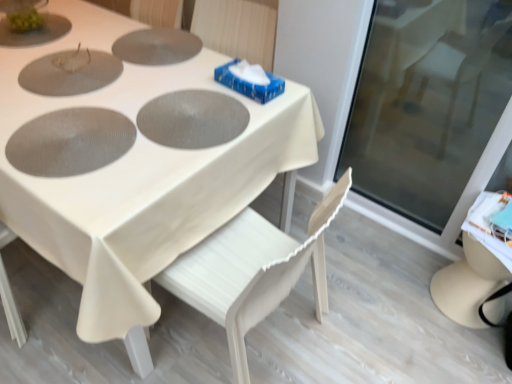
You are a GUI agent. You are given a task and a screenshot of the screen. Output one action in this format:
    pyautogui.click(x=<x>, y=<y>)
    Task: Click on the matte gray pizza pan at upper center, the 1th pizza pan when ordered from back to front
    The image size is (512, 384).
    Given the screenshot: What is the action you would take?
    pyautogui.click(x=157, y=46)

Describe the element at coordinates (157, 46) in the screenshot. I see `matte gray pizza pan at upper center, the 1th pizza pan when ordered from back to front` at that location.

This screenshot has width=512, height=384. Find the location of `matte gray pizza pan at center, which appears as the third pizza pan when viewed from the back`. matte gray pizza pan at center, which appears as the third pizza pan when viewed from the back is located at coordinates (70, 142).

At what (x,y) coordinates should I click in order to perform the action: click on matte gray pizza pan at upper center, which is the 3th pizza pan from front to back. Please return your answer as a coordinate pair (x, y). Looking at the image, I should click on (157, 46).

From a real-world perspective, which is physically above, matte gray pizza pan at upper center, which is the 3th pizza pan from front to back, or gray matte pizza pan at center, which is the second pizza pan in back-to-front order?

In real-world perspective, gray matte pizza pan at center, which is the second pizza pan in back-to-front order, is above.

Can you confirm if matte gray pizza pan at upper center, which is the 3th pizza pan from front to back, is positioned to the right of gray matte pizza pan at center, which is the second pizza pan in back-to-front order?

Incorrect, matte gray pizza pan at upper center, which is the 3th pizza pan from front to back, is not on the right side of gray matte pizza pan at center, which is the second pizza pan in back-to-front order.

Which is closer to the camera, (138,47) or (187,134)?

Point (138,47) is farther from the camera than point (187,134).

Which of these two, matte gray pizza pan at upper center, which is the 3th pizza pan from front to back, or gray matte pizza pan at center, which is the second pizza pan from front to back, stands shorter?

Standing shorter between the two is gray matte pizza pan at center, which is the second pizza pan from front to back.

Considering the relative sizes of white wood chair at center and gray matte pizza pan at center, which is the second pizza pan in back-to-front order, in the image provided, is white wood chair at center smaller than gray matte pizza pan at center, which is the second pizza pan in back-to-front order,?

No.

Considering the positions of objects white wood chair at center and gray matte pizza pan at center, which is the second pizza pan from front to back, in the image provided, who is behind, white wood chair at center or gray matte pizza pan at center, which is the second pizza pan from front to back,?

gray matte pizza pan at center, which is the second pizza pan from front to back, is more distant.

Is white wood chair at center far from gray matte pizza pan at center, which is the second pizza pan from front to back?

No, white wood chair at center is not far away from gray matte pizza pan at center, which is the second pizza pan from front to back.

Does white matte table at center come behind transparent glass door at right?

No, white matte table at center is closer to the viewer.

How distant is white matte table at center from transparent glass door at right?

31.61 inches.

Which object is positioned more to the left, white matte table at center or transparent glass door at right?

white matte table at center is more to the left.

What are the coordinates of `glass door on the right side of matte gray pizza pan at upper center, the 1th pizza pan when ordered from back to front` in the screenshot? It's located at (426, 102).

Based on their positions, is matte gray pizza pan at upper center, which is the 3th pizza pan from front to back, located to the left or right of transparent glass door at right?

In the image, matte gray pizza pan at upper center, which is the 3th pizza pan from front to back, appears on the left side of transparent glass door at right.

Is matte gray pizza pan at upper center, the 1th pizza pan when ordered from back to front, situated inside transparent glass door at right or outside?

matte gray pizza pan at upper center, the 1th pizza pan when ordered from back to front, is located beyond the bounds of transparent glass door at right.

Is matte gray pizza pan at upper center, the 1th pizza pan when ordered from back to front, looking in the opposite direction of transparent glass door at right?

matte gray pizza pan at upper center, the 1th pizza pan when ordered from back to front, does not have its back to transparent glass door at right.

Is point (151, 38) less distant than point (86, 37)?

Yes, it is.

From a real-world perspective, does matte gray pizza pan at upper center, which is the 3th pizza pan from front to back, stand above white matte table at center?

Indeed, from a real-world perspective, matte gray pizza pan at upper center, which is the 3th pizza pan from front to back, stands above white matte table at center.

Would you say matte gray pizza pan at upper center, which is the 3th pizza pan from front to back, is inside or outside white matte table at center?

matte gray pizza pan at upper center, which is the 3th pizza pan from front to back, can be found inside white matte table at center.

From the image's perspective, is matte gray pizza pan at upper center, which is the 3th pizza pan from front to back, above or below white matte table at center?

matte gray pizza pan at upper center, which is the 3th pizza pan from front to back, is above white matte table at center.

From a real-world perspective, is matte gray pizza pan at center, which appears as the third pizza pan when viewed from the back, above or below gray matte pizza pan at center, which is the second pizza pan in back-to-front order?

matte gray pizza pan at center, which appears as the third pizza pan when viewed from the back, is situated higher than gray matte pizza pan at center, which is the second pizza pan in back-to-front order, in the real world.

Is matte gray pizza pan at center, which appears as the third pizza pan when viewed from the back, aimed at gray matte pizza pan at center, which is the second pizza pan in back-to-front order?

No.

Relative to gray matte pizza pan at center, which is the second pizza pan from front to back, is matte gray pizza pan at center, which is counted as the 1th pizza pan, starting from the front, in front or behind?

In the image, matte gray pizza pan at center, which is counted as the 1th pizza pan, starting from the front, appears in front of gray matte pizza pan at center, which is the second pizza pan from front to back.

Which is nearer, (85, 131) or (178, 102)?

The point (85, 131) is closer to the camera.

Considering their positions, is white wood chair at center located in front of or behind matte gray pizza pan at center, which is counted as the 1th pizza pan, starting from the front?

white wood chair at center is positioned closer to the viewer than matte gray pizza pan at center, which is counted as the 1th pizza pan, starting from the front.

Is white wood chair at center aimed at matte gray pizza pan at center, which appears as the third pizza pan when viewed from the back?

Yes, white wood chair at center is oriented towards matte gray pizza pan at center, which appears as the third pizza pan when viewed from the back.

Visually, is white wood chair at center positioned to the left or to the right of matte gray pizza pan at center, which is counted as the 1th pizza pan, starting from the front?

Clearly, white wood chair at center is on the right of matte gray pizza pan at center, which is counted as the 1th pizza pan, starting from the front, in the image.

Does point (260, 304) appear closer or farther from the camera than point (39, 174)?

Point (260, 304) is farther from the camera than point (39, 174).

Find the location of a particular element. The image size is (512, 384). pizza pan below the gray matte pizza pan at center, which is the second pizza pan in back-to-front order (from a real-world perspective) is located at coordinates (157, 46).

From a real-world perspective, starting from the white wood chair at center, which pizza pan is the 2nd one vertically above it? Please provide its 2D coordinates.

[(192, 119)]

Considering their positions, is matte gray pizza pan at center, which is counted as the 1th pizza pan, starting from the front, positioned closer to matte gray pizza pan at upper center, which is the 3th pizza pan from front to back, than white matte table at center?

white matte table at center is positioned closer to the anchor matte gray pizza pan at upper center, which is the 3th pizza pan from front to back.

Considering their positions, is gray matte pizza pan at center, which is the second pizza pan in back-to-front order, positioned closer to white matte table at center than matte gray pizza pan at center, which appears as the third pizza pan when viewed from the back?

matte gray pizza pan at center, which appears as the third pizza pan when viewed from the back, lies closer to white matte table at center than the other object.

When comparing their distances from matte gray pizza pan at center, which is counted as the 1th pizza pan, starting from the front, does matte gray pizza pan at upper center, the 1th pizza pan when ordered from back to front, or white matte table at center seem closer?

Among the two, white matte table at center is located nearer to matte gray pizza pan at center, which is counted as the 1th pizza pan, starting from the front.

Based on their spatial positions, is white matte table at center or transparent glass door at right closer to gray matte pizza pan at center, which is the second pizza pan from front to back?

The object closer to gray matte pizza pan at center, which is the second pizza pan from front to back, is white matte table at center.

Looking at the image, which one is located closer to gray matte pizza pan at center, which is the second pizza pan from front to back, transparent glass door at right or white wood chair at center?

Among the two, white wood chair at center is located nearer to gray matte pizza pan at center, which is the second pizza pan from front to back.

Based on their spatial positions, is gray matte pizza pan at center, which is the second pizza pan in back-to-front order, or matte gray pizza pan at center, which appears as the third pizza pan when viewed from the back, closer to white wood chair at center?

gray matte pizza pan at center, which is the second pizza pan in back-to-front order, is closer to white wood chair at center.

Looking at the image, which one is located closer to gray matte pizza pan at center, which is the second pizza pan from front to back, matte gray pizza pan at upper center, the 1th pizza pan when ordered from back to front, or white wood chair at center?

The object closer to gray matte pizza pan at center, which is the second pizza pan from front to back, is matte gray pizza pan at upper center, the 1th pizza pan when ordered from back to front.

From the image, which object appears to be farther from transparent glass door at right, white matte table at center or white wood chair at center?

Among the two, white wood chair at center is located further to transparent glass door at right.

You are a GUI agent. You are given a task and a screenshot of the screen. Output one action in this format:
    pyautogui.click(x=<x>, y=<y>)
    Task: Click on the chair located between matte gray pizza pan at center, which is counted as the 1th pizza pan, starting from the front, and transparent glass door at right in the left-right direction
    This screenshot has width=512, height=384.
    Given the screenshot: What is the action you would take?
    pyautogui.click(x=252, y=271)

The image size is (512, 384). I want to click on chair between matte gray pizza pan at upper center, the 1th pizza pan when ordered from back to front, and transparent glass door at right from left to right, so click(x=252, y=271).

Find the location of a particular element. pizza pan between matte gray pizza pan at center, which is counted as the 1th pizza pan, starting from the front, and matte gray pizza pan at upper center, the 1th pizza pan when ordered from back to front, in the front-back direction is located at coordinates (192, 119).

This screenshot has height=384, width=512. I want to click on chair located between gray matte pizza pan at center, which is the second pizza pan from front to back, and transparent glass door at right in the left-right direction, so click(x=252, y=271).